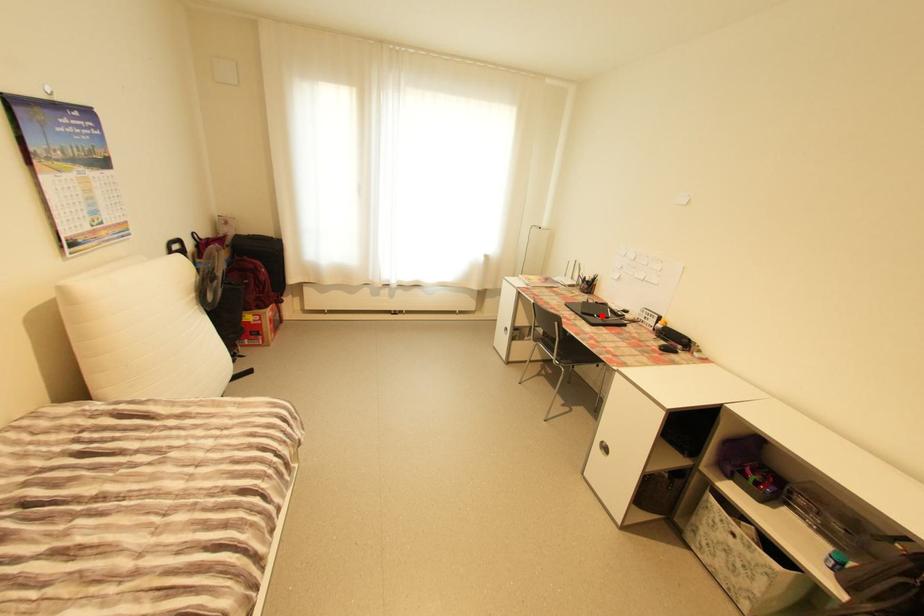
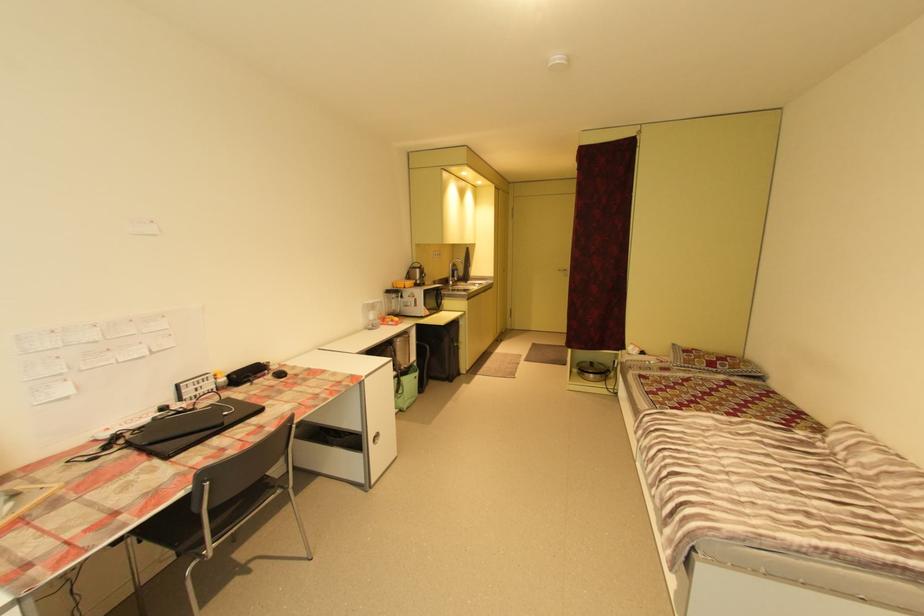
Locate, in the second image, the point that corresponds to the highlighted location in the first image.

(232, 414)